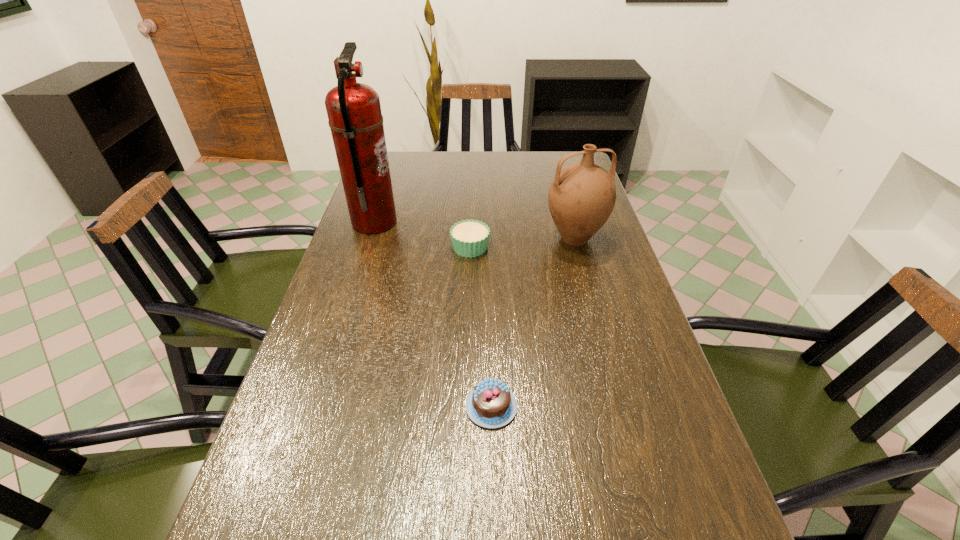
Locate an element on the screen. free point that satisfies the following two spatial constraints: 1. on the back side of the second tallest object; 2. on the right side of the nearest object is located at coordinates (488, 239).

You are a GUI agent. You are given a task and a screenshot of the screen. Output one action in this format:
    pyautogui.click(x=<x>, y=<y>)
    Task: Click on the vacant region that satisfies the following two spatial constraints: 1. on the nozzle side of the fire extinguisher; 2. on the right side of the nearest object
    This screenshot has width=960, height=540.
    Given the screenshot: What is the action you would take?
    pyautogui.click(x=316, y=406)

Locate an element on the screen. vacant space that satisfies the following two spatial constraints: 1. on the nozzle side of the tallest object; 2. on the back side of the cupcake is located at coordinates (367, 247).